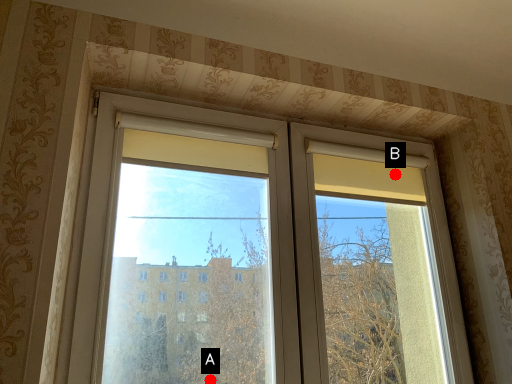
Question: Two points are circled on the image, labeled by A and B beside each circle. Which point is closer to the camera?

Choices:
 (A) A is closer
 (B) B is closer

Answer: (B)